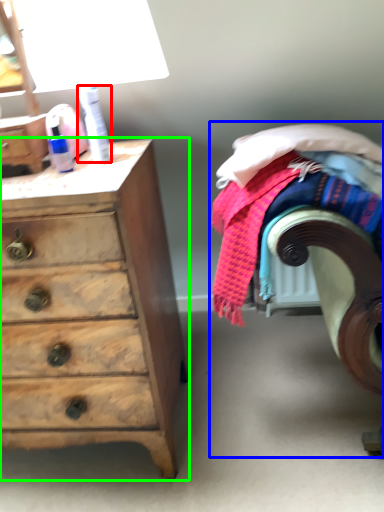
Question: Based on their relative distances, which object is nearer to toiletry (highlighted by a red box)? Choose from bed (highlighted by a blue box) and chest of drawers (highlighted by a green box).

Choices:
 (A) bed
 (B) chest of drawers

Answer: (B)